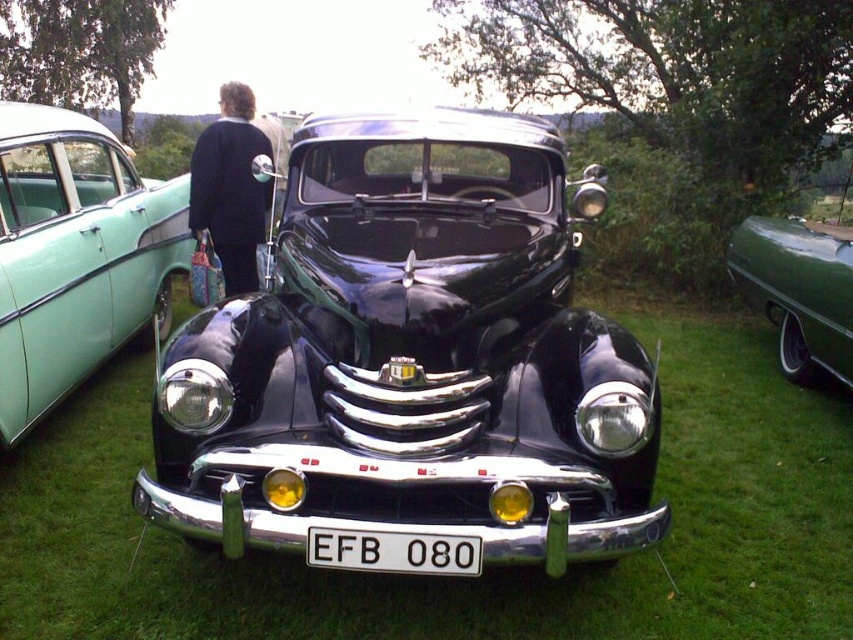
You are a photographer trying to capture both the shiny black car at center and the teal glossy sedan at left in a single shot. Based on their positions, which car should you focus on first to ensure both are in frame?

Since the shiny black car at center is located below the teal glossy sedan at left, you should focus on the teal glossy sedan at left first to ensure both are within the frame.

Looking at this image, you are a delivery person carrying a package that requires a 1.8 meter wide path to move. You need to deliver the package to the teal glossy sedan at left, which is parked next to the shiny black car at center. Is the space between the two cars wide enough for your delivery vehicle?

The shiny black car at center and teal glossy sedan at left are 2.08 meters apart from each other. Since the required path is 1.8 meters, the space between them is sufficient for the delivery vehicle to pass through.

You are a delivery person who needs to place a package in a black fabric bag at left. The shiny black car at center is blocking the path. Can you walk around the car to reach the bag?

The shiny black car at center is 7.68 feet away from the black fabric bag at left. Since the car is blocking the path, you can walk around it to reach the bag as there is enough space between them.